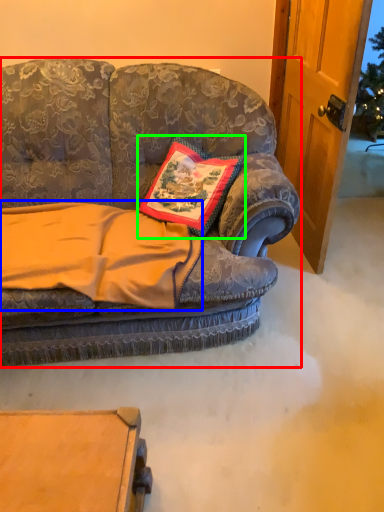
Question: Which is nearer to the studio couch (highlighted by a red box)? blanket (highlighted by a blue box) or pillow (highlighted by a green box).

Choices:
 (A) blanket
 (B) pillow

Answer: (A)